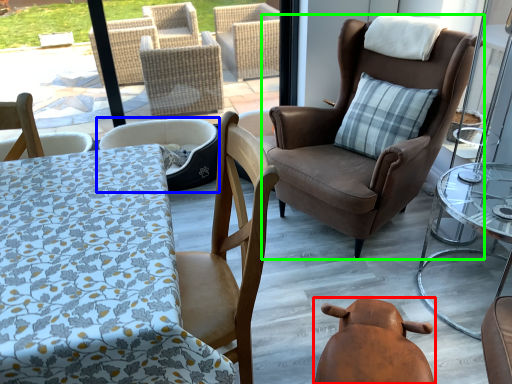
Question: Which is nearer to the swivel chair (highlighted by a red box)? chair (highlighted by a blue box) or chair (highlighted by a green box).

Choices:
 (A) chair
 (B) chair

Answer: (B)